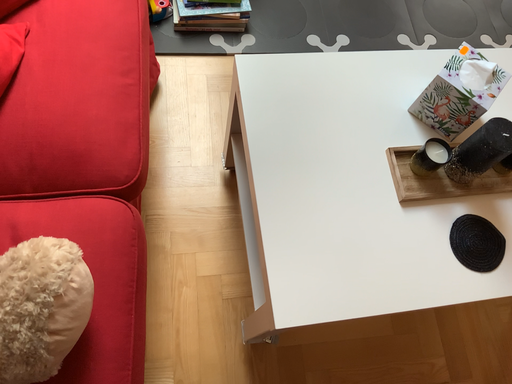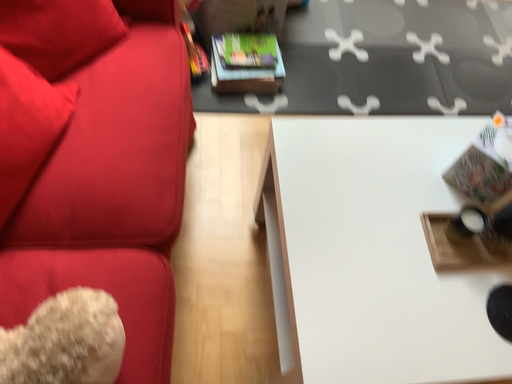
Question: Which way did the camera rotate in the video?

Choices:
 (A) rotated downward
 (B) rotated upward

Answer: (B)